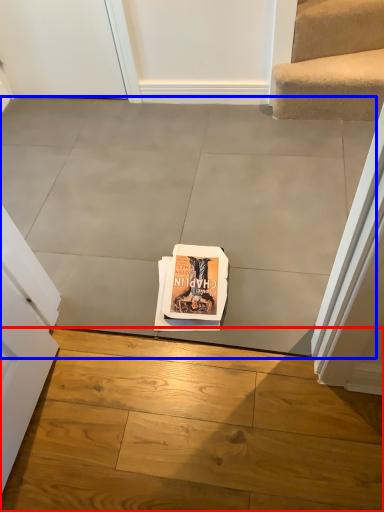
Question: Which point is further to the camera, concrete (highlighted by a red box) or concrete (highlighted by a blue box)?

Choices:
 (A) concrete
 (B) concrete

Answer: (B)